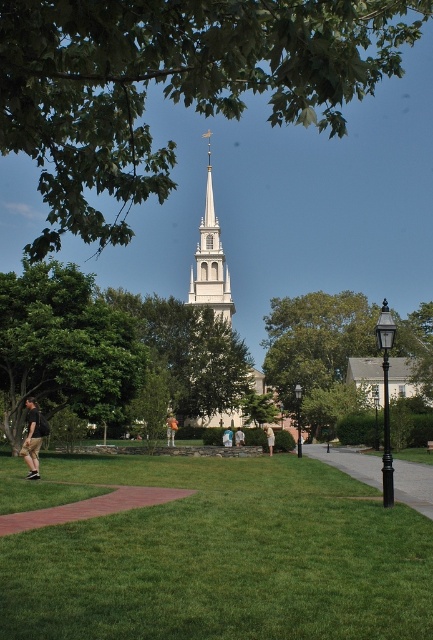
Question: Which of the following is the closest to the observer?

Choices:
 (A) light blue fabric shirt at center
 (B) light blue fabric at center
 (C) white cotton shirt at center

Answer: (B)

Question: Is the position of green leafy tree at center less distant than that of khaki pants at lower left?

Choices:
 (A) yes
 (B) no

Answer: (B)

Question: Which point appears farthest from the camera in this image?

Choices:
 (A) (42, 433)
 (B) (274, 435)
 (C) (378, 456)
 (D) (294, 380)

Answer: (D)

Question: Is green grass at lower center bigger than green leafy tree at left?

Choices:
 (A) no
 (B) yes

Answer: (B)

Question: Is green grass at lower center to the right of green leafy tree at center from the viewer's perspective?

Choices:
 (A) yes
 (B) no

Answer: (B)

Question: Based on their relative distances, which object is farther from the khaki pants at lower left?

Choices:
 (A) white cotton shirt at center
 (B) green leafy tree at center
 (C) black metal lamp post at lower right

Answer: (C)